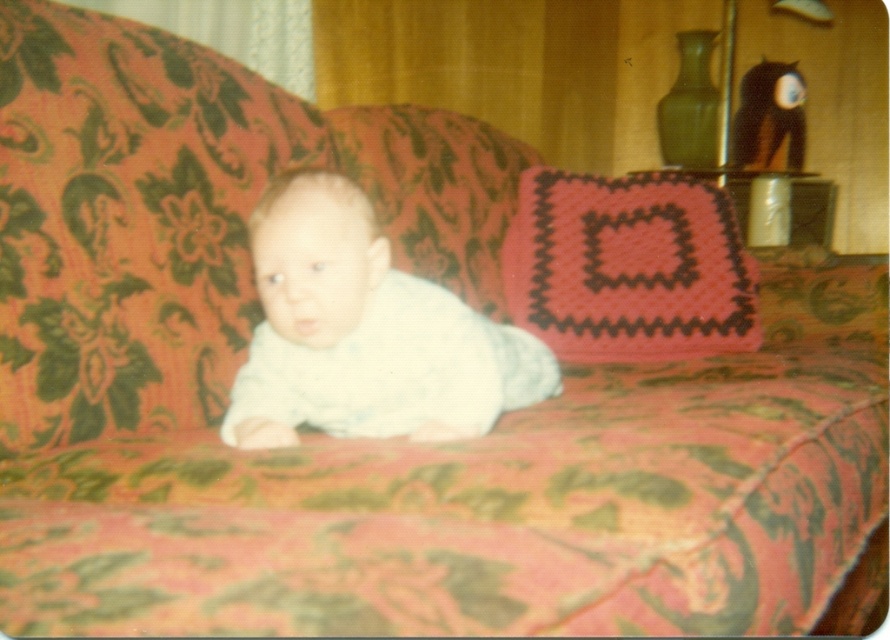
Is point (381, 269) more distant than point (716, 216)?

No.

Between white soft fabric baby at center and knitted pink pillow at center, which one appears on the right side from the viewer's perspective?

knitted pink pillow at center

What are the coordinates of `white soft fabric baby at center` in the screenshot? It's located at (365, 333).